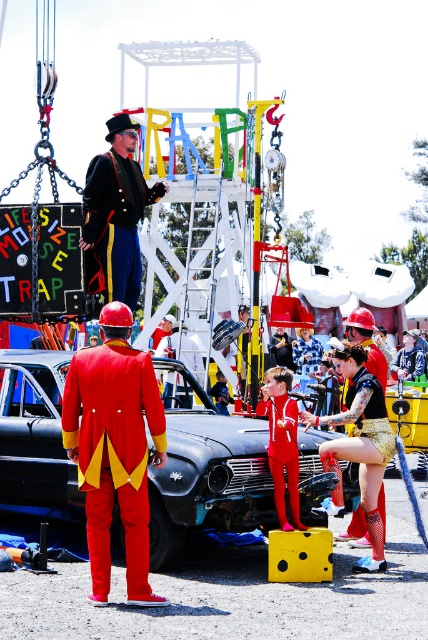
You are a photographer at the event and want to capture both the shiny red tuxedo at center and the shiny metallic shorts at center in a single photo. Which object should you focus on first to ensure both are in frame?

The shiny red tuxedo at center is not as tall as the shiny metallic shorts at center, so you should focus on the taller shiny metallic shorts at center first to ensure both are in frame.

You are a photographer standing at the base of the MOUSETRAP structure. You want to take a photo of the shiny red tuxedo at center and the man in the military uniform. How far apart should you position them in the frame to ensure both are clearly visible?

The shiny red tuxedo at center and the man in the military uniform are 39.73 meters apart. To ensure both are clearly visible, position them at least 39.73 meters apart in the frame.

You are an event planner trying to place a banner between the shiny red tuxedo at center and the large colorful mousetrap structure. Based on their positions, which object is closer to the left side of the image?

The shiny red tuxedo at center is located at point (115, 454), while the large colorful mousetrap structure is at the center of the image. Since 0.711 on the x axis is closer to the right side, the mousetrap structure is closer to the left side than the shiny red tuxedo at center. Therefore, the mousetrap structure is closer to the left side.